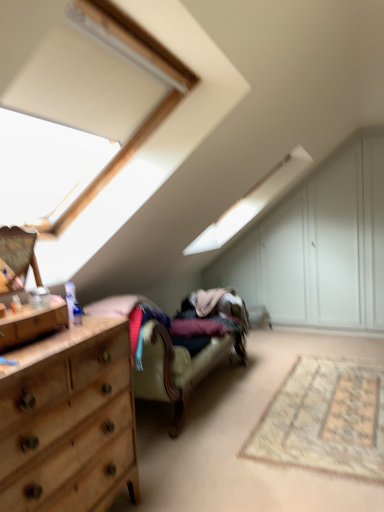
You are a GUI agent. You are given a task and a screenshot of the screen. Output one action in this format:
    pyautogui.click(x=<x>, y=<y>)
    Task: Click on the free space above beige woven rug at lower right (from a real-world perspective)
    The image size is (384, 512).
    Given the screenshot: What is the action you would take?
    pyautogui.click(x=333, y=406)